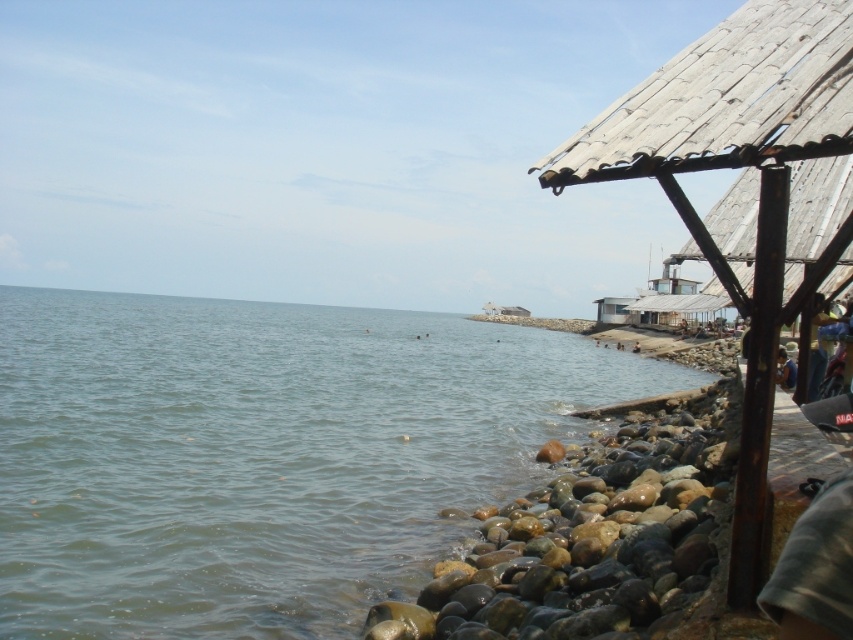
Question: Can you confirm if clear water at lower left is positioned below rusty metal roof at right?

Choices:
 (A) no
 (B) yes

Answer: (B)

Question: Considering the real-world distances, which object is closest to the clear water at lower left?

Choices:
 (A) rusty metallic rocks at lower right
 (B) rusty metal roof at right
 (C) dark blue fabric at lower right

Answer: (A)

Question: Which point appears closest to the camera in this image?

Choices:
 (A) (579, 525)
 (B) (824, 260)
 (C) (782, 369)

Answer: (B)

Question: Observing the image, what is the correct spatial positioning of rusty metal roof at right in reference to dark blue fabric at lower right?

Choices:
 (A) left
 (B) right

Answer: (A)

Question: Which object is farther from the camera taking this photo?

Choices:
 (A) rusty metal roof at right
 (B) clear water at lower left
 (C) dark blue fabric at lower right
 (D) rusty metallic rocks at lower right

Answer: (B)

Question: Does rusty metal roof at right have a lesser width compared to rusty metallic rocks at lower right?

Choices:
 (A) yes
 (B) no

Answer: (A)